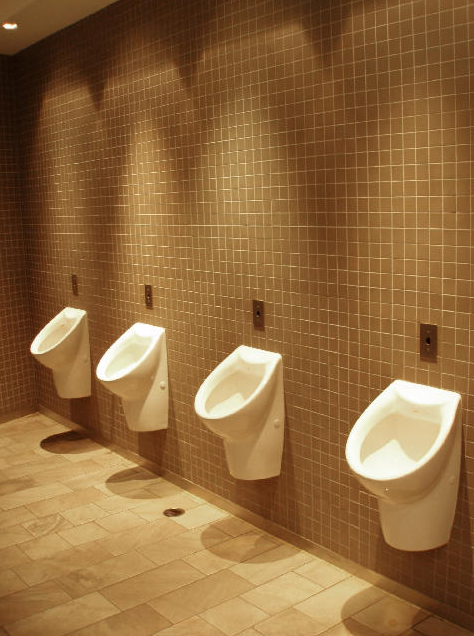
The height and width of the screenshot is (636, 474). What are the coordinates of `flush button` in the screenshot? It's located at (74, 282), (148, 298), (264, 318), (419, 346).